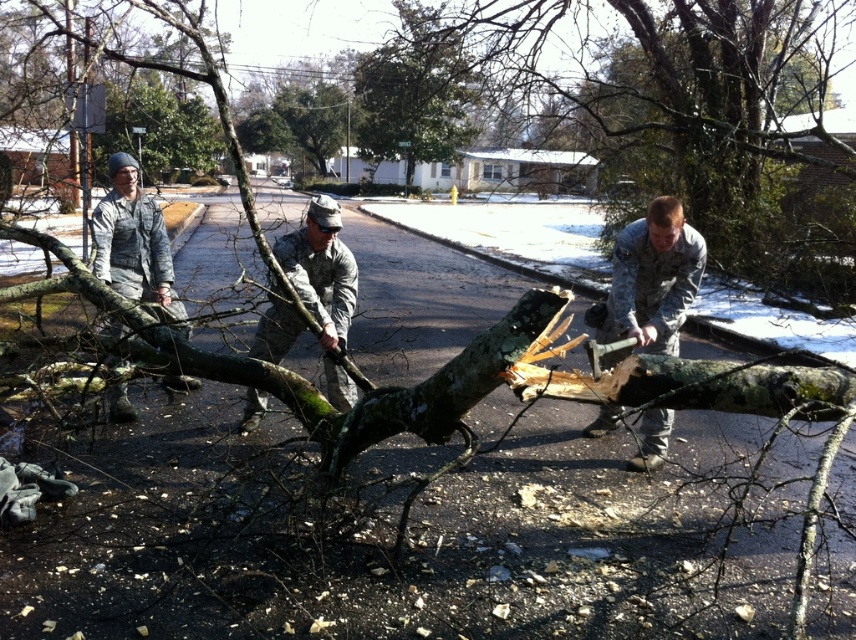
Looking at this image, is green leafy tree at center below camouflage uniform at left?

No, green leafy tree at center is not below camouflage uniform at left.

Which of these two, green leafy tree at center or camouflage uniform at left, stands shorter?

→ camouflage uniform at left is shorter.

Is point (389, 124) positioned before point (138, 228)?

No, (389, 124) is behind (138, 228).

I want to click on green leafy tree at center, so click(415, 93).

From the picture: Who is positioned more to the right, green camouflage uniform at center or camouflage uniform at left?

Positioned to the right is green camouflage uniform at center.

Image resolution: width=856 pixels, height=640 pixels. Describe the element at coordinates (324, 285) in the screenshot. I see `green camouflage uniform at center` at that location.

Locate an element on the screen. The image size is (856, 640). green camouflage uniform at center is located at coordinates (324, 285).

Which is above, green leafy tree at center or camouflage uniform at center?

green leafy tree at center is above.

Between point (407, 84) and point (614, 243), which one is positioned in front?

Point (614, 243)

The width and height of the screenshot is (856, 640). What do you see at coordinates (415, 93) in the screenshot?
I see `green leafy tree at center` at bounding box center [415, 93].

Find the location of `green leafy tree at center`. green leafy tree at center is located at coordinates [x=415, y=93].